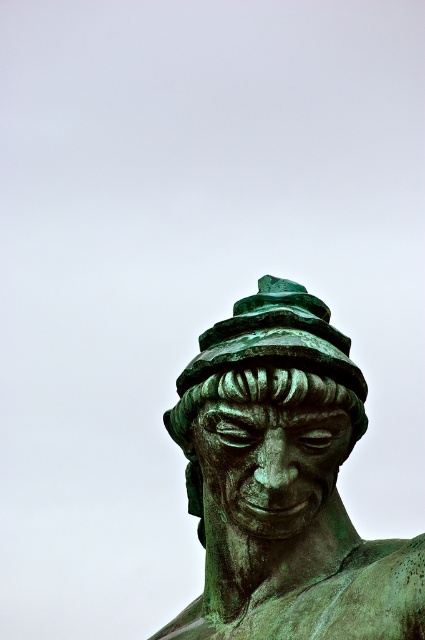
You are an art conservator examining the image. The statue is displayed in a museum with a coordinate grid system for preservation purposes. What are the coordinates of the green patina statue at center?

The coordinates of the green patina statue at center are at point (283,483).

You are an art conservator examining the bronze statue. You notice two points on the statue labeled as point (x=302, y=468) and point (x=329, y=336). Which of these points is positioned closer to your viewpoint?

Point (x=302, y=468) is closer to the viewer than point (x=329, y=336).